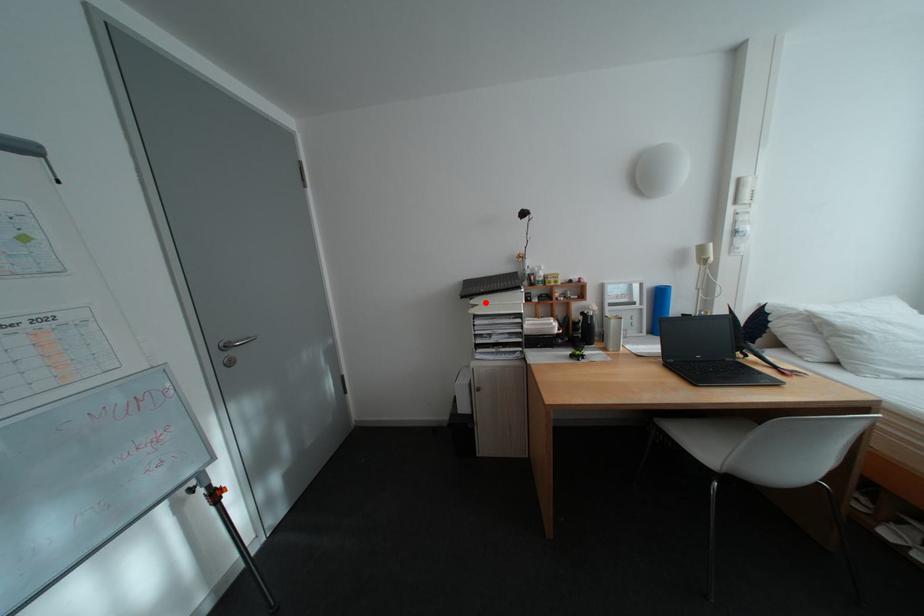
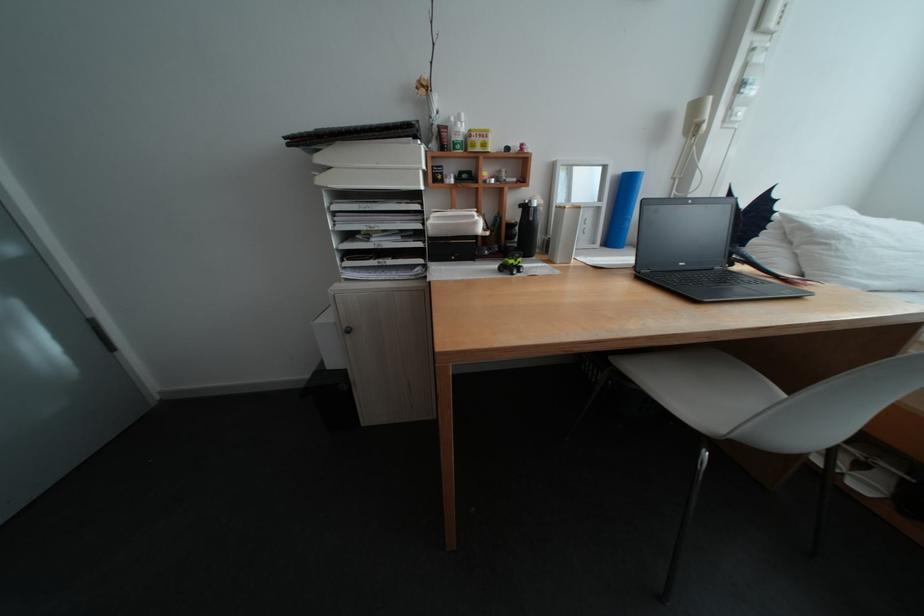
Find the pixel in the second image that matches the highlighted location in the first image.

(333, 160)